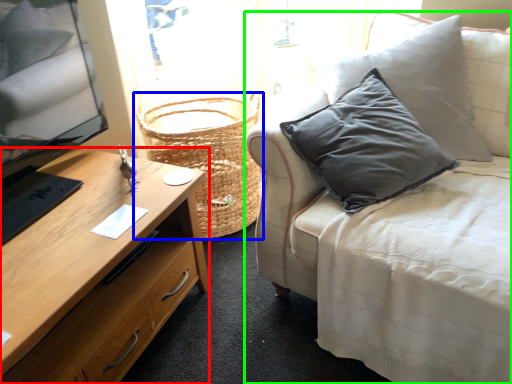
Question: Which object is the farthest from desk (highlighted by a red box)? Choose among these: basket (highlighted by a blue box) or studio couch (highlighted by a green box).

Choices:
 (A) basket
 (B) studio couch

Answer: (B)